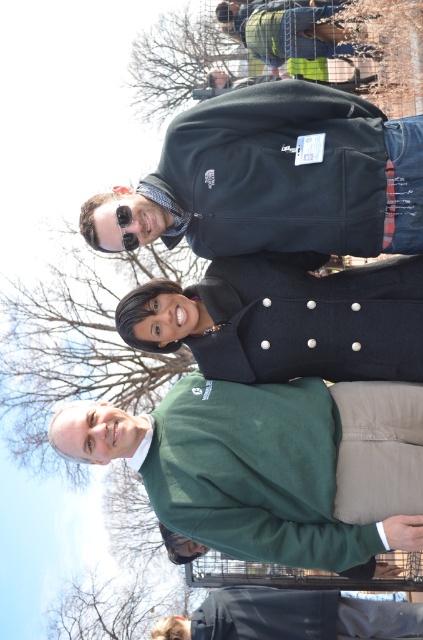
The image size is (423, 640). In order to click on dark blue fleece jacket at upper center in this screenshot , I will do `click(277, 179)`.

Does point (272, 189) come in front of point (120, 205)?

That is True.

Is point (208, 186) farther from viewer compared to point (120, 186)?

No, (208, 186) is in front of (120, 186).

The width and height of the screenshot is (423, 640). I want to click on dark blue fleece jacket at upper center, so click(x=277, y=179).

Measure the distance between dark blue fleece jacket at upper center and navy wool coat at center.

10.32 feet

Does dark blue fleece jacket at upper center appear on the right side of navy wool coat at center?

Yes, dark blue fleece jacket at upper center is to the right of navy wool coat at center.

Who is more forward, [362,132] or [397,259]?

Point [362,132]

At what (x,y) coordinates should I click in order to perform the action: click on dark blue fleece jacket at upper center. Please return your answer as a coordinate pair (x, y). Looking at the image, I should click on (277, 179).

Between dark blue fleece jacket at upper center and dark blue fabric at lower center, which one is positioned higher?

dark blue fleece jacket at upper center is above.

Does dark blue fleece jacket at upper center have a smaller size compared to dark blue fabric at lower center?

Yes, dark blue fleece jacket at upper center is smaller than dark blue fabric at lower center.

Is point (107, 220) less distant than point (216, 593)?

Yes, point (107, 220) is closer to viewer.

The height and width of the screenshot is (640, 423). Find the location of `dark blue fleece jacket at upper center`. dark blue fleece jacket at upper center is located at coordinates (277, 179).